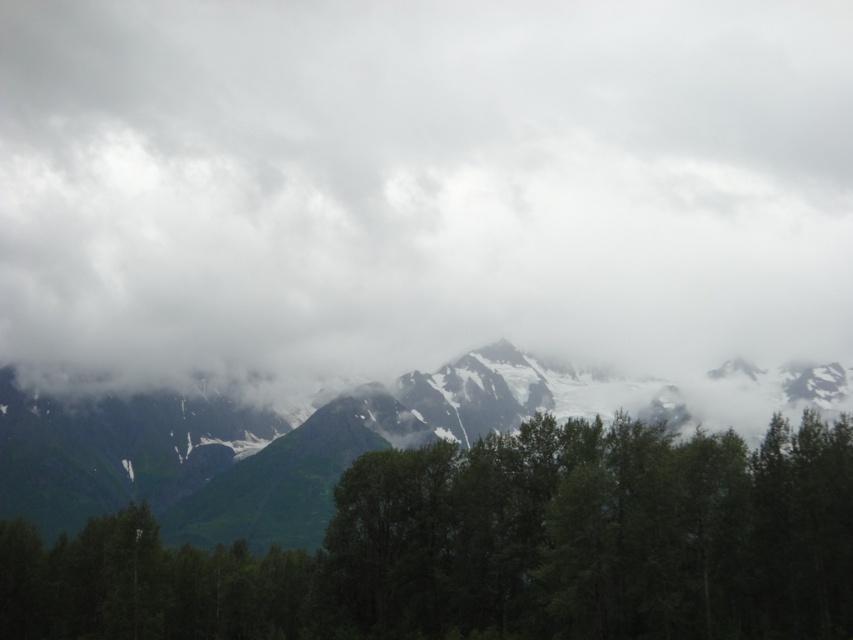
Who is taller, white fluffy cloud at upper center or green grassy mountain range at center?

Standing taller between the two is white fluffy cloud at upper center.

Between point (125, 140) and point (51, 436), which one is positioned behind?

Positioned behind is point (125, 140).

Between point (283, 224) and point (302, 544), which one is positioned behind?

The point (283, 224) is more distant.

You are a GUI agent. You are given a task and a screenshot of the screen. Output one action in this format:
    pyautogui.click(x=<x>, y=<y>)
    Task: Click on the white fluffy cloud at upper center
    
    Given the screenshot: What is the action you would take?
    pyautogui.click(x=422, y=184)